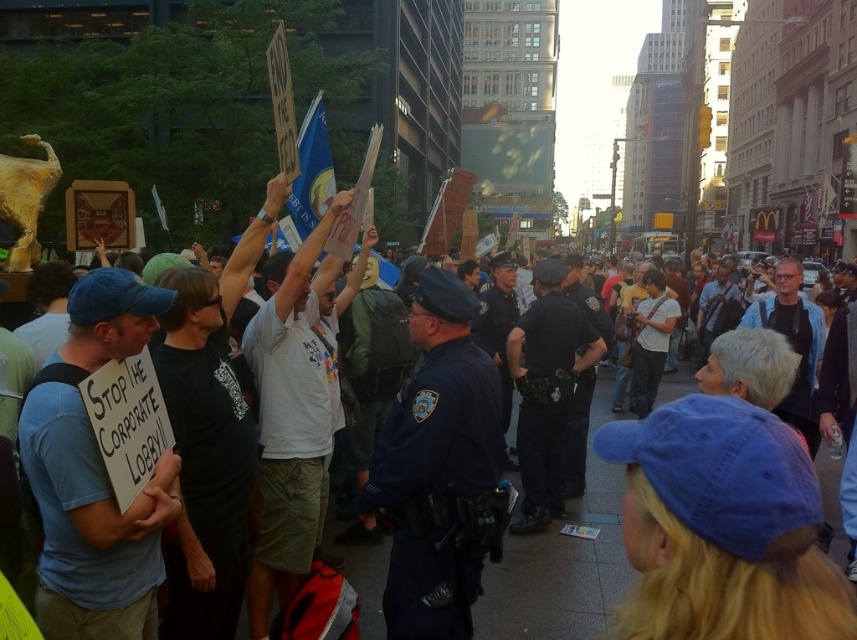
You are a journalist covering a protest. You notice two officers in the crowd. One is wearing a blue uniformed officer at center and the other is a dark blue uniform at center. From your vantage point, which officer is positioned to the left?

The blue uniformed officer at center is positioned to the left of the dark blue uniform at center.

You are a journalist trying to capture a photo of the protest. You notice two officers in the crowd. One is wearing a blue uniformed officer at center and the other is wearing a dark blue uniform at center. Which officer is positioned lower in the image?

The blue uniformed officer at center is located below dark blue uniform at center, so the officer in the blue uniformed officer at center is positioned lower in the image.

You are a photographer standing at the front of the crowd capturing the protest scene. You notice two points in your viewfinder at coordinates point (381, 490) and point (561, 394). Which point is closer to your camera?

Point (381, 490) is closer to the camera than point (561, 394).